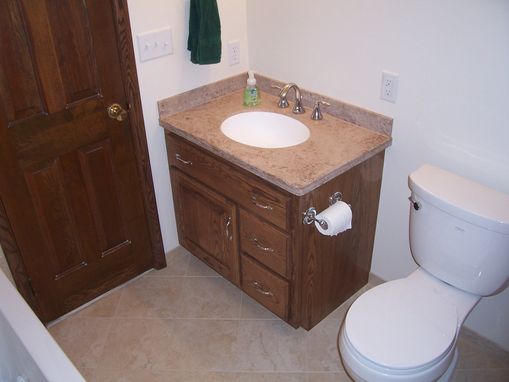
Where is `roll of toilet paper hanging`? The width and height of the screenshot is (509, 382). roll of toilet paper hanging is located at coordinates (336, 221).